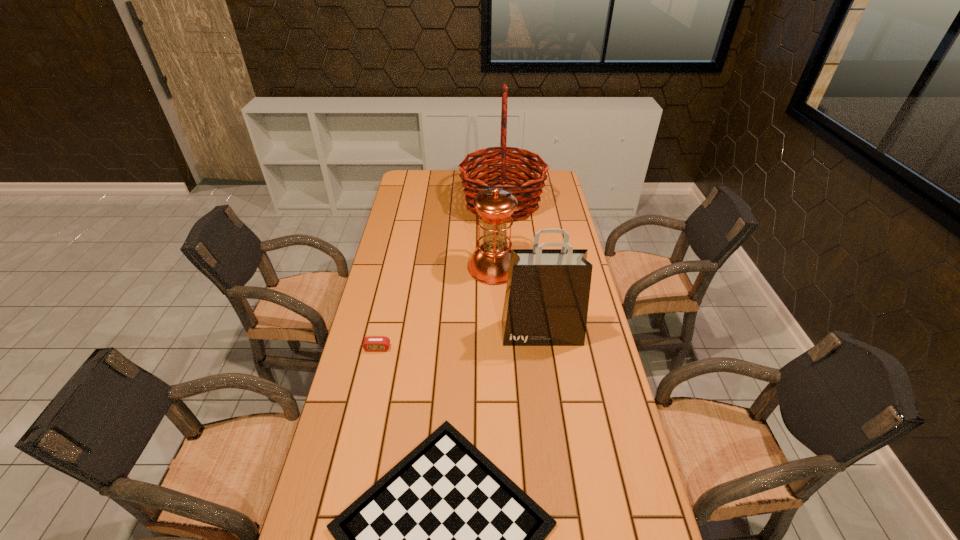
In order to click on object at the left edge in this screenshot , I will do `click(371, 343)`.

Locate an element on the screen. The height and width of the screenshot is (540, 960). basket at the right edge is located at coordinates (527, 193).

I want to click on shopping bag located in the right edge section of the desktop, so click(546, 302).

Where is `object that is at the far right corner`? Image resolution: width=960 pixels, height=540 pixels. object that is at the far right corner is located at coordinates (527, 193).

This screenshot has height=540, width=960. In the image, there is a desktop. Identify the location of vacant space at the far edge. (443, 188).

The height and width of the screenshot is (540, 960). Find the location of `free space at the left edge`. free space at the left edge is located at coordinates (328, 519).

The height and width of the screenshot is (540, 960). I want to click on vacant space at the right edge of the desktop, so click(x=534, y=220).

Where is `vacant space at the far left corner of the desktop`? This screenshot has width=960, height=540. vacant space at the far left corner of the desktop is located at coordinates (402, 186).

This screenshot has height=540, width=960. Identify the location of vacant area that lies between the shopping bag and the fourth tallest object. (460, 340).

Where is `empty location between the second shortest object and the oil lamp`? The height and width of the screenshot is (540, 960). empty location between the second shortest object and the oil lamp is located at coordinates (436, 308).